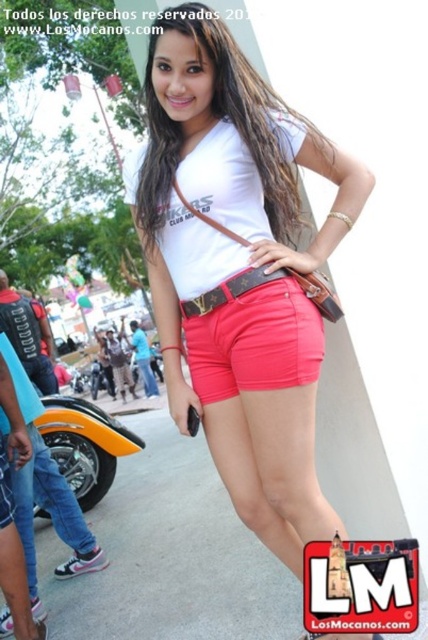
Which is more to the left, matte pink shorts at center or matte white hair at center?

From the viewer's perspective, matte white hair at center appears more on the left side.

Does matte pink shorts at center have a larger size compared to matte white hair at center?

Yes.

This screenshot has width=428, height=640. I want to click on matte pink shorts at center, so click(x=238, y=269).

This screenshot has width=428, height=640. I want to click on matte pink shorts at center, so click(x=238, y=269).

Is matte pink shorts at center to the right of brown leather belt at center from the viewer's perspective?

Correct, you'll find matte pink shorts at center to the right of brown leather belt at center.

Does matte pink shorts at center have a greater height compared to brown leather belt at center?

Yes, matte pink shorts at center is taller than brown leather belt at center.

Locate an element on the screen. The width and height of the screenshot is (428, 640). matte pink shorts at center is located at coordinates (238, 269).

The width and height of the screenshot is (428, 640). What are the coordinates of `matte pink shorts at center` in the screenshot? It's located at (238, 269).

Measure the distance between pink cotton shorts at lower center and camera.

pink cotton shorts at lower center and camera are 2.29 meters apart from each other.

Who is higher up, pink cotton shorts at lower center or brown leather belt at center?

brown leather belt at center is higher up.

What do you see at coordinates (44, 492) in the screenshot? I see `pink cotton shorts at lower center` at bounding box center [44, 492].

In order to click on pink cotton shorts at lower center in this screenshot , I will do `click(44, 492)`.